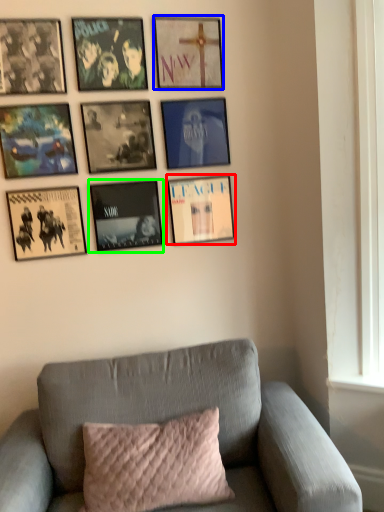
Question: Which is nearer to the picture frame (highlighted by a red box)? picture frame (highlighted by a blue box) or picture frame (highlighted by a green box).

Choices:
 (A) picture frame
 (B) picture frame

Answer: (B)